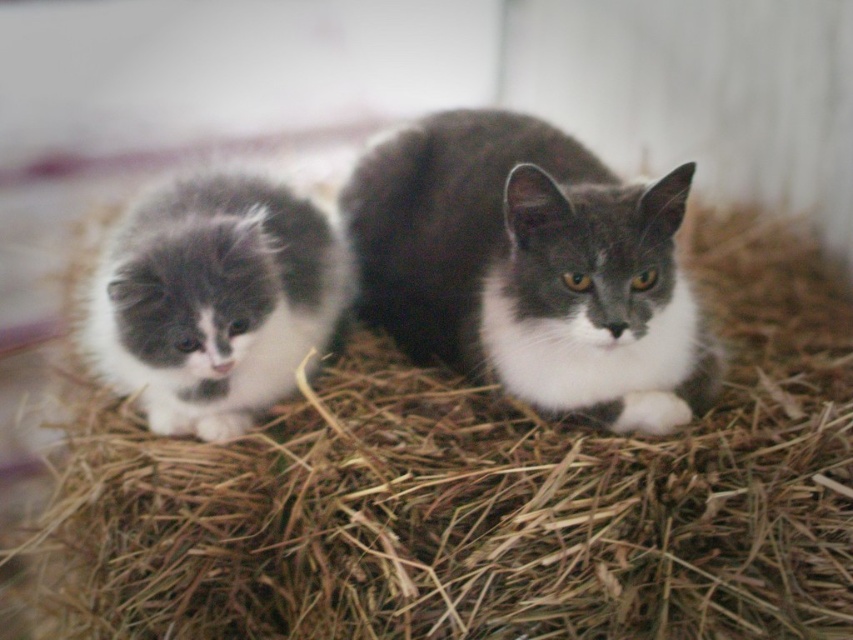
Does gray fluffy cat at center appear over fluffy gray kitten at left?

Indeed, gray fluffy cat at center is positioned over fluffy gray kitten at left.

Does point (434, 266) lie in front of point (221, 243)?

No, it is not.

What are the coordinates of `gray fluffy cat at center` in the screenshot? It's located at (531, 268).

You are a GUI agent. You are given a task and a screenshot of the screen. Output one action in this format:
    pyautogui.click(x=<x>, y=<y>)
    Task: Click on the gray fluffy cat at center
    
    Given the screenshot: What is the action you would take?
    pyautogui.click(x=531, y=268)

Does brown straw at center have a greater height compared to gray fluffy cat at center?

Yes, brown straw at center is taller than gray fluffy cat at center.

Image resolution: width=853 pixels, height=640 pixels. What are the coordinates of `brown straw at center` in the screenshot? It's located at (482, 497).

The height and width of the screenshot is (640, 853). I want to click on brown straw at center, so click(482, 497).

Based on the photo, is brown straw at center positioned in front of fluffy gray kitten at left?

Yes, it is in front of fluffy gray kitten at left.

Is brown straw at center wider than fluffy gray kitten at left?

Correct, the width of brown straw at center exceeds that of fluffy gray kitten at left.

What do you see at coordinates (482, 497) in the screenshot? The width and height of the screenshot is (853, 640). I see `brown straw at center` at bounding box center [482, 497].

This screenshot has height=640, width=853. In order to click on brown straw at center in this screenshot , I will do `click(482, 497)`.